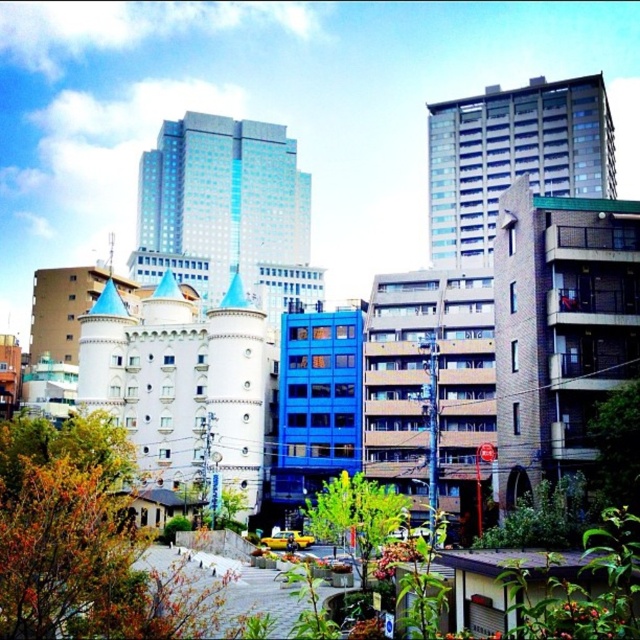
You are standing at the center of the paved pathway in the urban scene. You see two points marked in the image. Which point is closer to you, point (472, 236) or point (344, 468)?

Point (472, 236) is closer to you because it is further to the viewer than point (344, 468).

In the scene shown: You are a pedestrian standing at the start of the pathway in this urban scene. You want to walk towards the gray concrete building at upper center and the green leafy tree at lower right. Which object will you reach first?

The green leafy tree at lower right will be reached first because the gray concrete building at upper center is positioned to the right of it, meaning the tree is closer to your starting point on the pathway.